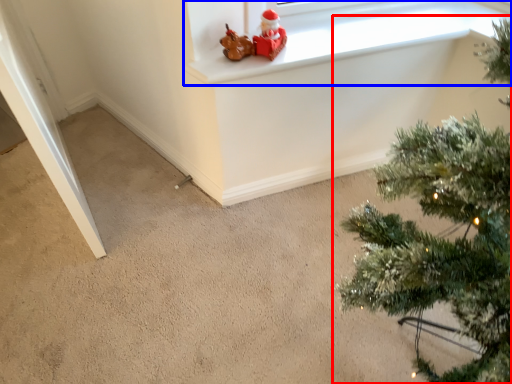
Question: Which of the following is the farthest to the observer, christmas tree (highlighted by a red box) or window frame (highlighted by a blue box)?

Choices:
 (A) christmas tree
 (B) window frame

Answer: (B)